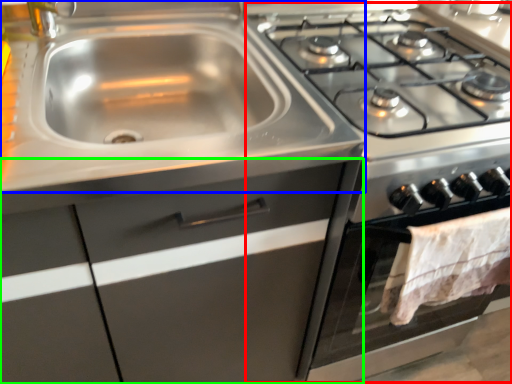
Question: Considering the real-world distances, which object is farthest from appliance (highlighted by a red box)? sink (highlighted by a blue box) or cabinetry (highlighted by a green box)?

Choices:
 (A) sink
 (B) cabinetry

Answer: (A)